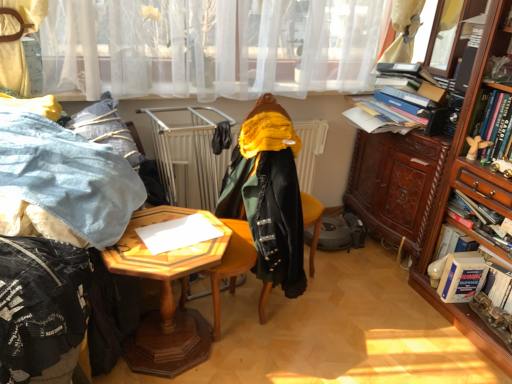
You are a GUI agent. You are given a task and a screenshot of the screen. Output one action in this format:
    pyautogui.click(x=<x>, y=<y>)
    Task: Click on the vacant area in front of dark brown wood cabinet at right, arranged as the 2th cabinetry when viewed from the front
    
    Given the screenshot: What is the action you would take?
    pyautogui.click(x=374, y=285)